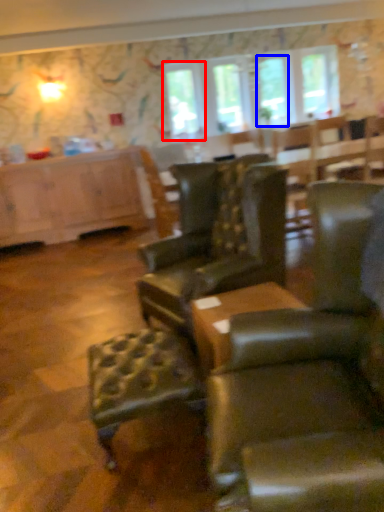
Question: Which of the following is the closest to the observer, window screen (highlighted by a red box) or window screen (highlighted by a blue box)?

Choices:
 (A) window screen
 (B) window screen

Answer: (A)